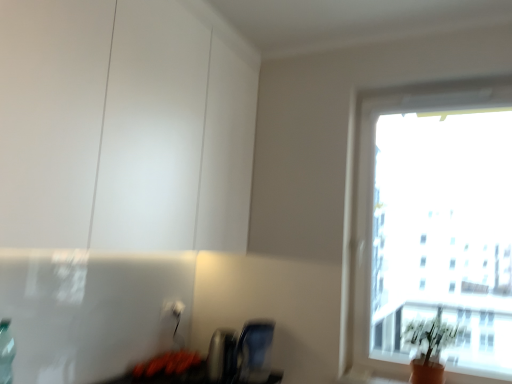
Find the location of a particular element. The width and height of the screenshot is (512, 384). transparent glass window at upper right is located at coordinates point(435,224).

Identify the location of white plastic electric outlet at lower center, the 1th electric outlet in the right-to-left sequence. This screenshot has height=384, width=512. (177, 309).

The width and height of the screenshot is (512, 384). I want to click on matte blue swivel chair at lower center, so click(x=254, y=352).

This screenshot has height=384, width=512. Describe the element at coordinates (174, 309) in the screenshot. I see `white plastic electric outlet at lower center, acting as the second electric outlet starting from the right` at that location.

The height and width of the screenshot is (384, 512). In order to click on transparent glass window at upper right in this screenshot , I will do `click(435, 224)`.

Between transparent glass window at upper right and matte white cabinet at upper left, which one appears on the left side from the viewer's perspective?

From the viewer's perspective, matte white cabinet at upper left appears more on the left side.

How distant is transparent glass window at upper right from matte white cabinet at upper left?

A distance of 2.92 meters exists between transparent glass window at upper right and matte white cabinet at upper left.

Which object is further away from the camera taking this photo, transparent glass window at upper right or matte white cabinet at upper left?

transparent glass window at upper right is further from the camera.

Can you confirm if transparent glass window at upper right is smaller than matte white cabinet at upper left?

Indeed, transparent glass window at upper right has a smaller size compared to matte white cabinet at upper left.

In the scene shown: Which of these two, matte blue swivel chair at lower center or white plastic electric outlet at lower center, the 1th electric outlet in the right-to-left sequence, is smaller?

With smaller size is white plastic electric outlet at lower center, the 1th electric outlet in the right-to-left sequence.

Which is more to the left, matte blue swivel chair at lower center or white plastic electric outlet at lower center, the second electric outlet in the left-to-right sequence?

white plastic electric outlet at lower center, the second electric outlet in the left-to-right sequence.

Which is in front, matte blue swivel chair at lower center or white plastic electric outlet at lower center, the second electric outlet in the left-to-right sequence?

matte blue swivel chair at lower center is more forward.

Is matte blue swivel chair at lower center with white plastic electric outlet at lower center, the 1th electric outlet in the right-to-left sequence?

No, matte blue swivel chair at lower center is not in contact with white plastic electric outlet at lower center, the 1th electric outlet in the right-to-left sequence.

Which point is more forward, (113, 205) or (448, 140)?

The point (113, 205) is closer to the camera.

Image resolution: width=512 pixels, height=384 pixels. Find the location of `cabinetry that is in front of the transparent glass window at upper right`. cabinetry that is in front of the transparent glass window at upper right is located at coordinates (122, 128).

Looking at their sizes, would you say matte white cabinet at upper left is wider or thinner than transparent glass window at upper right?

Considering their sizes, matte white cabinet at upper left looks broader than transparent glass window at upper right.

Would you say matte white cabinet at upper left is inside or outside transparent glass window at upper right?

matte white cabinet at upper left cannot be found inside transparent glass window at upper right.

Does matte white cabinet at upper left have a larger size compared to white plastic electric outlet at lower center, which is the first electric outlet in left-to-right order?

Yes, matte white cabinet at upper left is bigger than white plastic electric outlet at lower center, which is the first electric outlet in left-to-right order.

Is matte white cabinet at upper left next to white plastic electric outlet at lower center, which is the first electric outlet in left-to-right order?

No, matte white cabinet at upper left is not with white plastic electric outlet at lower center, which is the first electric outlet in left-to-right order.

Is white plastic electric outlet at lower center, the 1th electric outlet in the right-to-left sequence, outside of transparent glass window at upper right?

Yes, white plastic electric outlet at lower center, the 1th electric outlet in the right-to-left sequence, is not within transparent glass window at upper right.

Looking at this image, who is bigger, white plastic electric outlet at lower center, the 1th electric outlet in the right-to-left sequence, or transparent glass window at upper right?

With larger size is transparent glass window at upper right.

How far apart are white plastic electric outlet at lower center, the second electric outlet in the left-to-right sequence, and transparent glass window at upper right?

2.83 meters.

The height and width of the screenshot is (384, 512). I want to click on electric outlet that is the 1st one when counting leftward from the transparent glass window at upper right, so click(177, 309).

Which is more to the left, green matte plant at lower right or matte white cabinet at upper left?

Positioned to the left is matte white cabinet at upper left.

The height and width of the screenshot is (384, 512). Find the location of `cabinetry lying above the green matte plant at lower right (from the image's perspective)`. cabinetry lying above the green matte plant at lower right (from the image's perspective) is located at coordinates (122, 128).

Is green matte plant at lower right located outside matte white cabinet at upper left?

That's correct, green matte plant at lower right is outside of matte white cabinet at upper left.

From the image's perspective, is green matte plant at lower right beneath matte white cabinet at upper left?

Correct, green matte plant at lower right appears lower than matte white cabinet at upper left in the image.

From a real-world perspective, who is located lower, green matte plant at lower right or white plastic electric outlet at lower center, the second electric outlet in the left-to-right sequence?

green matte plant at lower right.

Considering the relative sizes of green matte plant at lower right and white plastic electric outlet at lower center, the 1th electric outlet in the right-to-left sequence, in the image provided, is green matte plant at lower right taller than white plastic electric outlet at lower center, the 1th electric outlet in the right-to-left sequence,?

Indeed, green matte plant at lower right has a greater height compared to white plastic electric outlet at lower center, the 1th electric outlet in the right-to-left sequence.

Between green matte plant at lower right and white plastic electric outlet at lower center, the 1th electric outlet in the right-to-left sequence, which one has smaller size?

Smaller between the two is white plastic electric outlet at lower center, the 1th electric outlet in the right-to-left sequence.

Is point (462, 336) behind point (170, 310)?

No, (462, 336) is closer to viewer.

Find the location of a particular element. Image resolution: width=512 pixels, height=384 pixels. window on the right side of matte white cabinet at upper left is located at coordinates (435, 224).

This screenshot has width=512, height=384. I want to click on the 1st electric outlet to the left when counting from the matte blue swivel chair at lower center, so click(x=177, y=309).

Which object lies nearer to the anchor point white plastic electric outlet at lower center, the second electric outlet in the left-to-right sequence, matte blue swivel chair at lower center or green matte plant at lower right?

Among the two, matte blue swivel chair at lower center is located nearer to white plastic electric outlet at lower center, the second electric outlet in the left-to-right sequence.

Looking at the image, which one is located closer to white plastic electric outlet at lower center, the 1th electric outlet in the right-to-left sequence, matte blue swivel chair at lower center or transparent glass window at upper right?

Among the two, matte blue swivel chair at lower center is located nearer to white plastic electric outlet at lower center, the 1th electric outlet in the right-to-left sequence.

Estimate the real-world distances between objects in this image. Which object is closer to matte blue swivel chair at lower center, matte white cabinet at upper left or white plastic electric outlet at lower center, acting as the second electric outlet starting from the right?

white plastic electric outlet at lower center, acting as the second electric outlet starting from the right, is positioned closer to the anchor matte blue swivel chair at lower center.

From the image, which object appears to be farther from matte white cabinet at upper left, white plastic electric outlet at lower center, the 1th electric outlet in the right-to-left sequence, or white plastic electric outlet at lower center, acting as the second electric outlet starting from the right?

The object further to matte white cabinet at upper left is white plastic electric outlet at lower center, the 1th electric outlet in the right-to-left sequence.

Based on their spatial positions, is white plastic electric outlet at lower center, which is the first electric outlet in left-to-right order, or matte blue swivel chair at lower center further from matte white cabinet at upper left?

white plastic electric outlet at lower center, which is the first electric outlet in left-to-right order, lies further to matte white cabinet at upper left than the other object.

Looking at this image, looking at the image, which one is located closer to white plastic electric outlet at lower center, acting as the second electric outlet starting from the right, matte blue swivel chair at lower center or matte white cabinet at upper left?

matte blue swivel chair at lower center lies closer to white plastic electric outlet at lower center, acting as the second electric outlet starting from the right, than the other object.

Which object lies further to the anchor point white plastic electric outlet at lower center, which is the first electric outlet in left-to-right order, matte blue swivel chair at lower center or transparent glass window at upper right?

Based on the image, transparent glass window at upper right appears to be further to white plastic electric outlet at lower center, which is the first electric outlet in left-to-right order.

Consider the image. From the image, which object appears to be nearer to matte blue swivel chair at lower center, green matte plant at lower right or white plastic electric outlet at lower center, the second electric outlet in the left-to-right sequence?

Based on the image, white plastic electric outlet at lower center, the second electric outlet in the left-to-right sequence, appears to be nearer to matte blue swivel chair at lower center.

Identify the location of swivel chair between white plastic electric outlet at lower center, which is the first electric outlet in left-to-right order, and transparent glass window at upper right. (254, 352).

Identify the location of swivel chair between white plastic electric outlet at lower center, the second electric outlet in the left-to-right sequence, and green matte plant at lower right, in the horizontal direction. The width and height of the screenshot is (512, 384). (254, 352).

At what (x,y) coordinates should I click in order to perform the action: click on electric outlet located between white plastic electric outlet at lower center, which is the first electric outlet in left-to-right order, and transparent glass window at upper right in the left-right direction. Please return your answer as a coordinate pair (x, y). The height and width of the screenshot is (384, 512). Looking at the image, I should click on (177, 309).

Locate an element on the screen. The width and height of the screenshot is (512, 384). swivel chair located between matte white cabinet at upper left and white plastic electric outlet at lower center, which is the first electric outlet in left-to-right order, in the depth direction is located at coordinates (254, 352).